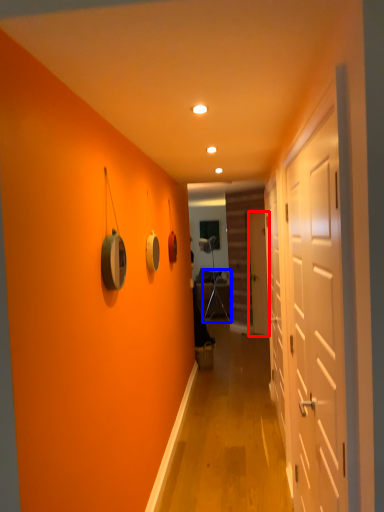
Question: Which point is closer to the camera, door (highlighted by a red box) or armchair (highlighted by a blue box)?

Choices:
 (A) door
 (B) armchair

Answer: (A)